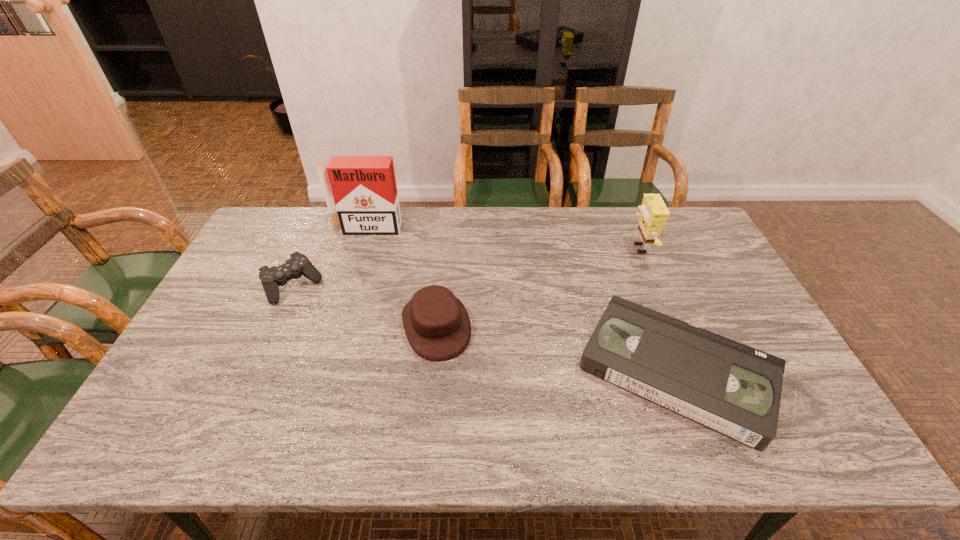
What are the coordinates of `vacant space at the right edge` in the screenshot? It's located at (742, 315).

Where is `vacant space at the far left corner of the desktop`? The height and width of the screenshot is (540, 960). vacant space at the far left corner of the desktop is located at coordinates (271, 246).

The width and height of the screenshot is (960, 540). I want to click on vacant space at the near left corner of the desktop, so click(168, 417).

The height and width of the screenshot is (540, 960). I want to click on vacant area that lies between the cigarette case and the videotape, so click(x=521, y=300).

Locate an element on the screen. free area in between the sponge and the third object from right to left is located at coordinates (538, 287).

I want to click on vacant point located between the videotape and the control, so click(x=485, y=329).

Locate an element on the screen. free point between the second tallest object and the control is located at coordinates (466, 267).

The width and height of the screenshot is (960, 540). I want to click on empty space that is in between the hat and the sponge, so click(538, 287).

This screenshot has height=540, width=960. Find the location of `vacant space in between the fourth shortest object and the shortest object`. vacant space in between the fourth shortest object and the shortest object is located at coordinates tap(658, 309).

Where is `empty space that is in between the videotape and the control`? The height and width of the screenshot is (540, 960). empty space that is in between the videotape and the control is located at coordinates pos(485,329).